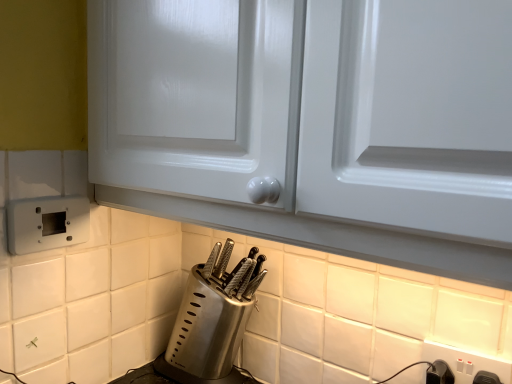
How much space does white plastic electric outlet at lower right, the first electric outlet ordered from the bottom, occupy horizontally?

It is 0.80 inches.

Describe the element at coordinates (47, 223) in the screenshot. The width and height of the screenshot is (512, 384). I see `white plastic electric outlet at lower left, the second electric outlet when ordered from bottom to top` at that location.

You are a GUI agent. You are given a task and a screenshot of the screen. Output one action in this format:
    pyautogui.click(x=<x>, y=<y>)
    Task: Click on the satin silver knife block at lower center
    Image resolution: width=512 pixels, height=384 pixels.
    Given the screenshot: What is the action you would take?
    pyautogui.click(x=212, y=319)

Can you confirm if white plastic electric outlet at lower right, which ranks as the second electric outlet in top-to-bottom order, is thinner than black plastic switch at lower right?

Yes.

Is white plastic electric outlet at lower right, the first electric outlet ordered from the bottom, not near black plastic switch at lower right?

Actually, white plastic electric outlet at lower right, the first electric outlet ordered from the bottom, and black plastic switch at lower right are a little close together.

Is white plastic electric outlet at lower right, acting as the 2th electric outlet starting from the left, at the left side of black plastic switch at lower right?

Incorrect, white plastic electric outlet at lower right, acting as the 2th electric outlet starting from the left, is not on the left side of black plastic switch at lower right.

Does point (450, 361) come farther from viewer compared to point (444, 381)?

Yes, it is.

Would you consider black plastic switch at lower right to be distant from white plastic electric outlet at lower left, the 1th electric outlet when ordered from top to bottom?

They are positioned close to each other.

Considering the relative sizes of black plastic switch at lower right and white plastic electric outlet at lower left, which appears as the first electric outlet when viewed from the left, in the image provided, is black plastic switch at lower right thinner than white plastic electric outlet at lower left, which appears as the first electric outlet when viewed from the left,?

Incorrect, the width of black plastic switch at lower right is not less than that of white plastic electric outlet at lower left, which appears as the first electric outlet when viewed from the left.

Considering the positions of objects black plastic switch at lower right and white plastic electric outlet at lower left, the 1th electric outlet when ordered from top to bottom, in the image provided, who is more to the left, black plastic switch at lower right or white plastic electric outlet at lower left, the 1th electric outlet when ordered from top to bottom,?

white plastic electric outlet at lower left, the 1th electric outlet when ordered from top to bottom, is more to the left.

From a real-world perspective, relative to white plastic electric outlet at lower right, placed as the first electric outlet when sorted from right to left, is black plastic switch at lower right vertically above or below?

black plastic switch at lower right is below white plastic electric outlet at lower right, placed as the first electric outlet when sorted from right to left.

Looking at this image, could you tell me if black plastic switch at lower right is turned towards white plastic electric outlet at lower right, acting as the 2th electric outlet starting from the left?

No, black plastic switch at lower right is not oriented towards white plastic electric outlet at lower right, acting as the 2th electric outlet starting from the left.

Are black plastic switch at lower right and white plastic electric outlet at lower right, placed as the first electric outlet when sorted from right to left, located far from each other?

Actually, black plastic switch at lower right and white plastic electric outlet at lower right, placed as the first electric outlet when sorted from right to left, are a little close together.

Identify the location of switch behind the white plastic electric outlet at lower right, the first electric outlet ordered from the bottom. This screenshot has height=384, width=512. (439, 373).

From the image's perspective, who appears lower, satin silver knife block at lower center or white plastic electric outlet at lower right, the first electric outlet ordered from the bottom?

white plastic electric outlet at lower right, the first electric outlet ordered from the bottom, appears lower in the image.

Who is taller, satin silver knife block at lower center or white plastic electric outlet at lower right, the first electric outlet ordered from the bottom?

Standing taller between the two is satin silver knife block at lower center.

Considering the relative positions of satin silver knife block at lower center and white plastic electric outlet at lower right, placed as the first electric outlet when sorted from right to left, in the image provided, is satin silver knife block at lower center in front of white plastic electric outlet at lower right, placed as the first electric outlet when sorted from right to left,?

No, the depth of satin silver knife block at lower center is greater than that of white plastic electric outlet at lower right, placed as the first electric outlet when sorted from right to left.

Is black plastic switch at lower right bigger or smaller than satin silver knife block at lower center?

Clearly, black plastic switch at lower right is smaller in size than satin silver knife block at lower center.

Does black plastic switch at lower right have a greater height compared to satin silver knife block at lower center?

No, black plastic switch at lower right is not taller than satin silver knife block at lower center.

Where is `switch in front of the satin silver knife block at lower center`? switch in front of the satin silver knife block at lower center is located at coordinates (439, 373).

From the image's perspective, which one is positioned higher, black plastic switch at lower right or satin silver knife block at lower center?

satin silver knife block at lower center.

Considering the relative sizes of white plastic electric outlet at lower left, the second electric outlet when ordered from bottom to top, and satin silver knife block at lower center in the image provided, is white plastic electric outlet at lower left, the second electric outlet when ordered from bottom to top, bigger than satin silver knife block at lower center?

Incorrect, white plastic electric outlet at lower left, the second electric outlet when ordered from bottom to top, is not larger than satin silver knife block at lower center.

Measure the distance from white plastic electric outlet at lower left, the second electric outlet when ordered from bottom to top, to satin silver knife block at lower center.

white plastic electric outlet at lower left, the second electric outlet when ordered from bottom to top, is 36.57 centimeters from satin silver knife block at lower center.

Is satin silver knife block at lower center at the back of white plastic electric outlet at lower left, the second electric outlet in the right-to-left sequence?

No, white plastic electric outlet at lower left, the second electric outlet in the right-to-left sequence,'s orientation is not away from satin silver knife block at lower center.

Would you say white plastic electric outlet at lower left, the second electric outlet when ordered from bottom to top, is outside satin silver knife block at lower center?

Absolutely, white plastic electric outlet at lower left, the second electric outlet when ordered from bottom to top, is external to satin silver knife block at lower center.

Does satin silver knife block at lower center appear on the right side of white plastic electric outlet at lower left, the 1th electric outlet when ordered from top to bottom?

Indeed, satin silver knife block at lower center is positioned on the right side of white plastic electric outlet at lower left, the 1th electric outlet when ordered from top to bottom.

Measure the distance from satin silver knife block at lower center to white plastic electric outlet at lower left, the second electric outlet in the right-to-left sequence.

satin silver knife block at lower center is 36.57 centimeters away from white plastic electric outlet at lower left, the second electric outlet in the right-to-left sequence.

Is satin silver knife block at lower center facing towards white plastic electric outlet at lower left, which appears as the first electric outlet when viewed from the left?

No, satin silver knife block at lower center is not oriented towards white plastic electric outlet at lower left, which appears as the first electric outlet when viewed from the left.

From a real-world perspective, is satin silver knife block at lower center under white plastic electric outlet at lower left, the second electric outlet in the right-to-left sequence?

Indeed, from a real-world perspective, satin silver knife block at lower center is positioned beneath white plastic electric outlet at lower left, the second electric outlet in the right-to-left sequence.

The height and width of the screenshot is (384, 512). I want to click on switch below the white plastic electric outlet at lower right, acting as the 2th electric outlet starting from the left (from the image's perspective), so click(439, 373).

The width and height of the screenshot is (512, 384). What are the coordinates of `electric outlet on the left side of black plastic switch at lower right` in the screenshot? It's located at (47, 223).

Considering their positions, is white plastic electric outlet at lower left, which appears as the first electric outlet when viewed from the left, positioned further to black plastic switch at lower right than satin silver knife block at lower center?

white plastic electric outlet at lower left, which appears as the first electric outlet when viewed from the left, is further to black plastic switch at lower right.

Looking at the image, which one is located further to satin silver knife block at lower center, white plastic electric outlet at lower left, the second electric outlet in the right-to-left sequence, or black plastic switch at lower right?

black plastic switch at lower right is positioned further to the anchor satin silver knife block at lower center.

From the image, which object appears to be nearer to white plastic electric outlet at lower right, acting as the 2th electric outlet starting from the left, black plastic switch at lower right or satin silver knife block at lower center?

black plastic switch at lower right.

Considering their positions, is satin silver knife block at lower center positioned closer to white plastic electric outlet at lower left, the 1th electric outlet when ordered from top to bottom, than white plastic electric outlet at lower right, acting as the 2th electric outlet starting from the left?

A: satin silver knife block at lower center is closer to white plastic electric outlet at lower left, the 1th electric outlet when ordered from top to bottom.

From the image, which object appears to be nearer to white plastic electric outlet at lower left, the 1th electric outlet when ordered from top to bottom, black plastic switch at lower right or white plastic electric outlet at lower right, which ranks as the second electric outlet in top-to-bottom order?

white plastic electric outlet at lower right, which ranks as the second electric outlet in top-to-bottom order, is positioned closer to the anchor white plastic electric outlet at lower left, the 1th electric outlet when ordered from top to bottom.

Considering their positions, is white plastic electric outlet at lower left, which appears as the first electric outlet when viewed from the left, positioned closer to white plastic electric outlet at lower right, the first electric outlet ordered from the bottom, than black plastic switch at lower right?

black plastic switch at lower right is positioned closer to the anchor white plastic electric outlet at lower right, the first electric outlet ordered from the bottom.

Considering their positions, is white plastic electric outlet at lower right, which ranks as the second electric outlet in top-to-bottom order, positioned closer to satin silver knife block at lower center than black plastic switch at lower right?

Among the two, white plastic electric outlet at lower right, which ranks as the second electric outlet in top-to-bottom order, is located nearer to satin silver knife block at lower center.

Based on their spatial positions, is white plastic electric outlet at lower right, the first electric outlet ordered from the bottom, or black plastic switch at lower right closer to white plastic electric outlet at lower left, the 1th electric outlet when ordered from top to bottom?

Based on the image, white plastic electric outlet at lower right, the first electric outlet ordered from the bottom, appears to be nearer to white plastic electric outlet at lower left, the 1th electric outlet when ordered from top to bottom.

Locate an element on the screen. The height and width of the screenshot is (384, 512). switch between satin silver knife block at lower center and white plastic electric outlet at lower right, placed as the first electric outlet when sorted from right to left is located at coordinates (439, 373).

Where is `kitchen appliance between white plastic electric outlet at lower left, the second electric outlet in the right-to-left sequence, and black plastic switch at lower right from left to right`? This screenshot has height=384, width=512. kitchen appliance between white plastic electric outlet at lower left, the second electric outlet in the right-to-left sequence, and black plastic switch at lower right from left to right is located at coordinates (212, 319).

You are a GUI agent. You are given a task and a screenshot of the screen. Output one action in this format:
    pyautogui.click(x=<x>, y=<y>)
    Task: Click on the switch situated between white plastic electric outlet at lower left, the second electric outlet when ordered from bottom to top, and white plastic electric outlet at lower right, placed as the first electric outlet when sorted from right to left, from left to right
    The height and width of the screenshot is (384, 512).
    Given the screenshot: What is the action you would take?
    pyautogui.click(x=439, y=373)

You are a GUI agent. You are given a task and a screenshot of the screen. Output one action in this format:
    pyautogui.click(x=<x>, y=<y>)
    Task: Click on the kitchen appliance between white plastic electric outlet at lower left, which appears as the first electric outlet when viewed from the left, and white plastic electric outlet at lower right, placed as the first electric outlet when sorted from right to left, from left to right
    
    Given the screenshot: What is the action you would take?
    pyautogui.click(x=212, y=319)